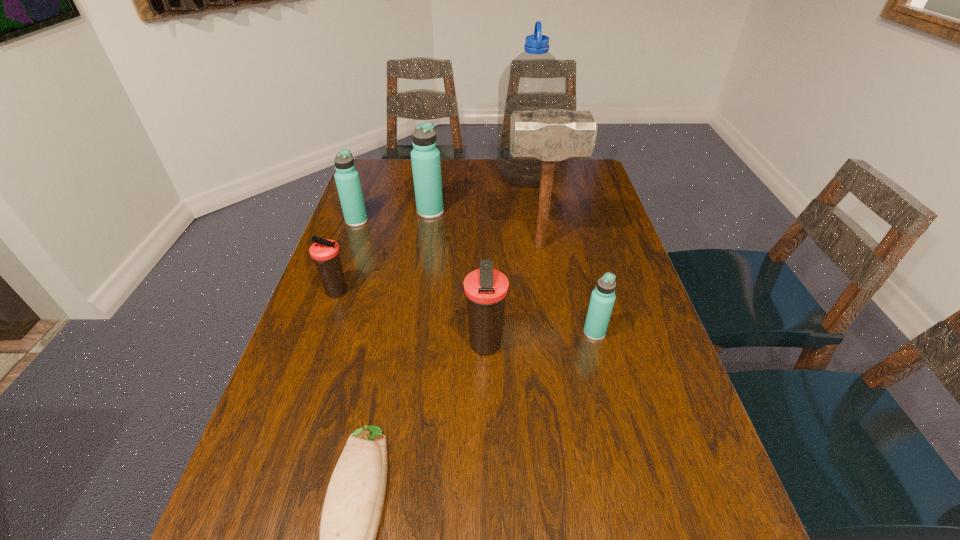
Identify which thermos bottle is the second closest to the nearer brown thermos bottle. Please provide its 2D coordinates. Your answer should be formatted as a tuple, i.e. [(x, y)], where the tuple contains the x and y coordinates of a point satisfying the conditions above.

[(325, 253)]

This screenshot has width=960, height=540. What are the coordinates of `aqua thermos bottle that is the second closest one to the burrito` in the screenshot? It's located at (347, 179).

Identify which aqua thermos bottle is located as the third nearest to the tallest object. Please provide its 2D coordinates. Your answer should be formatted as a tuple, i.e. [(x, y)], where the tuple contains the x and y coordinates of a point satisfying the conditions above.

[(602, 300)]

The width and height of the screenshot is (960, 540). I want to click on vacant space that satisfies the following two spatial constraints: 1. on the front side of the leftmost aqua thermos bottle; 2. on the left side of the smaller brown thermos bottle, so click(331, 293).

The height and width of the screenshot is (540, 960). I want to click on vacant area in the image that satisfies the following two spatial constraints: 1. on the striking face of the seventh shortest object; 2. on the front side of the farther brown thermos bottle, so click(x=547, y=293).

The height and width of the screenshot is (540, 960). In order to click on vacant space that satisfies the following two spatial constraints: 1. on the striking face of the fifth nearest object; 2. on the front side of the left brown thermos bottle in this screenshot , I will do `click(547, 293)`.